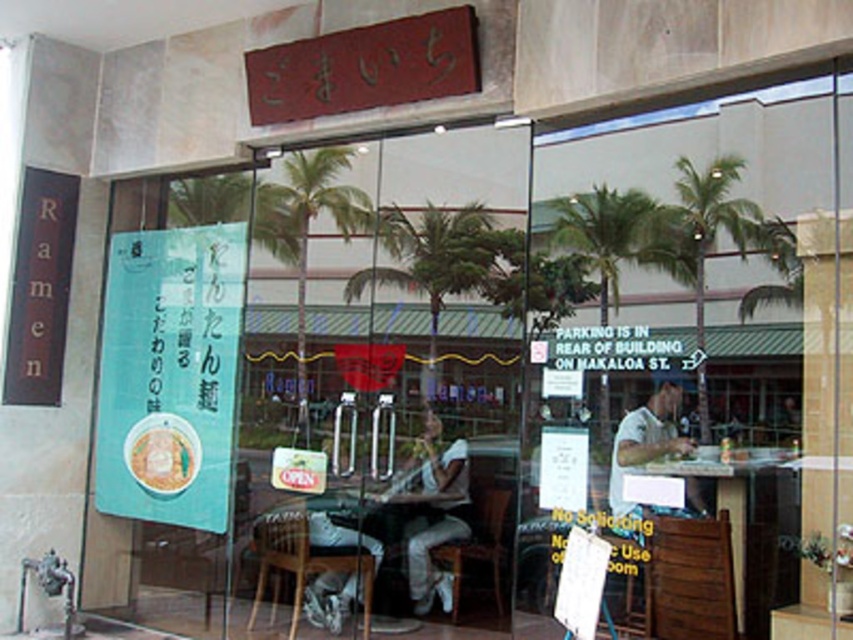
You are standing outside the ramen restaurant and want to enter. You notice the black wood sign at left and the wooden chair at lower center. Which object is closer to you as you face the entrance?

The black wood sign at left is closer to you because it is in front of the wooden chair at lower center.

You are standing outside the ramen restaurant and want to sit at the wooden table at center. Which direction should you move towards after entering through the glass doors?

The wooden table at center is located at point (743, 525), which is towards the lower right of the image. After entering through the glass doors, you should move towards the lower right direction to reach the wooden table at center.